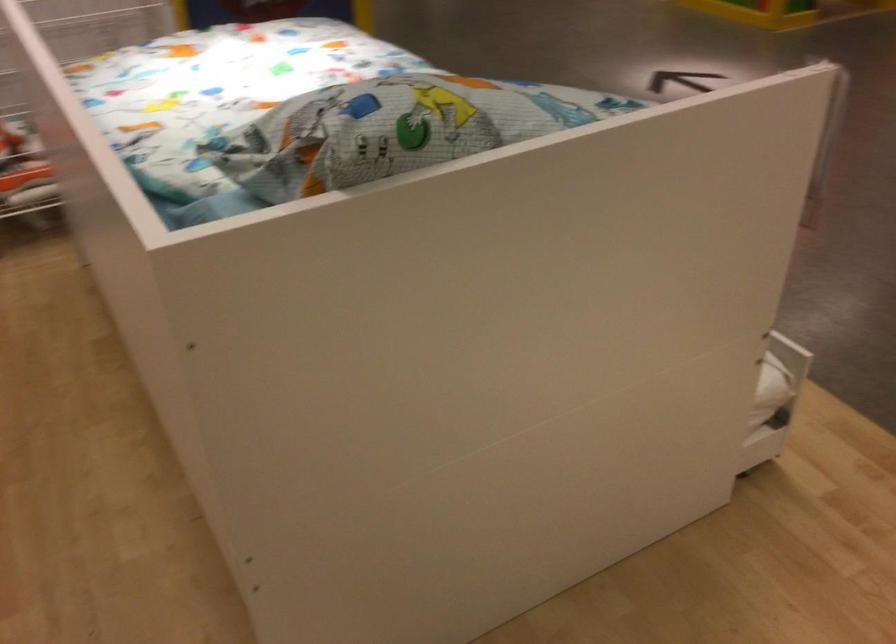
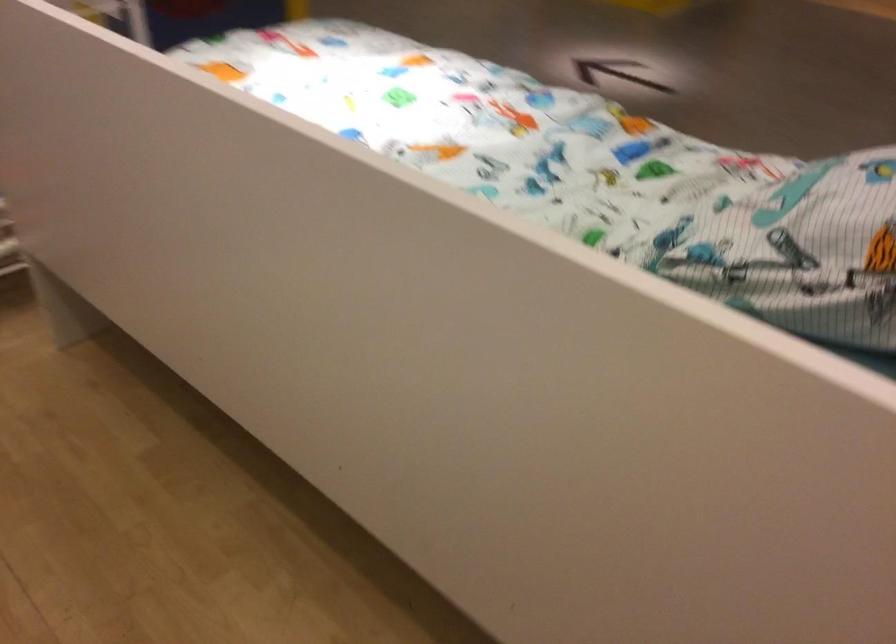
Which direction would the cameraman need to move to produce the second image?

The movement direction of the cameraman is left, forward.